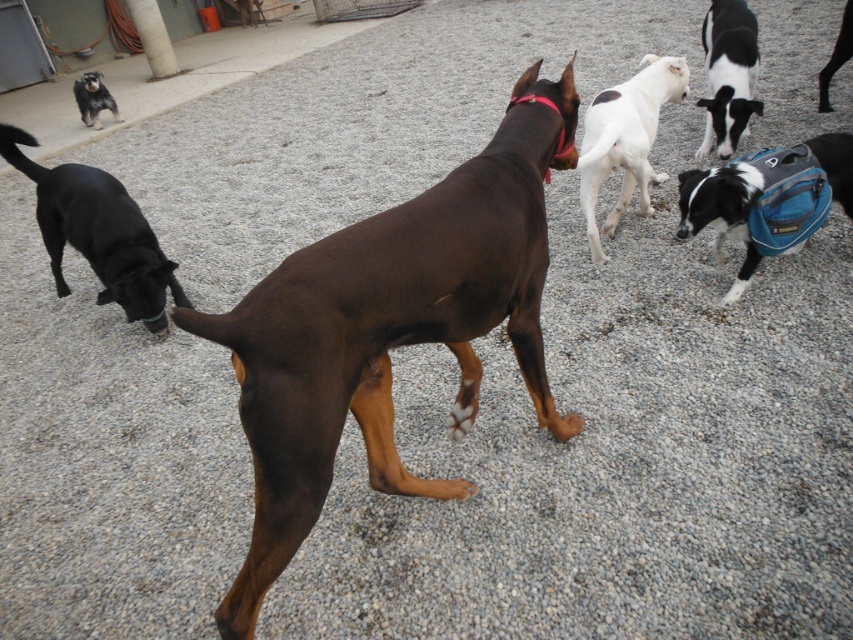
You are standing at the center of the image and want to find the black smooth dog at left. According to the coordinates provided, in which direction should you look to locate it?

The black smooth dog at left is located at coordinates point (97, 232). Since you are at the center, you should look to the left direction to find it.

You are standing in the scene and see the black and white fur at upper right and the black smooth coat at upper right. Which of these two dogs is closer to the left side of the image?

The black and white fur at upper right is positioned on the left side of the black smooth coat at upper right, so it is closer to the left side of the image.

You are standing at the camera position and want to throw a ball to a point that is exactly 10 feet away. Is the point at coordinates point (723, 84) within this range?

The distance of point (723, 84) from camera is 12.86 feet, so the point is beyond the 10 feet range. You cannot throw the ball to that point and have it land exactly 10 feet away.